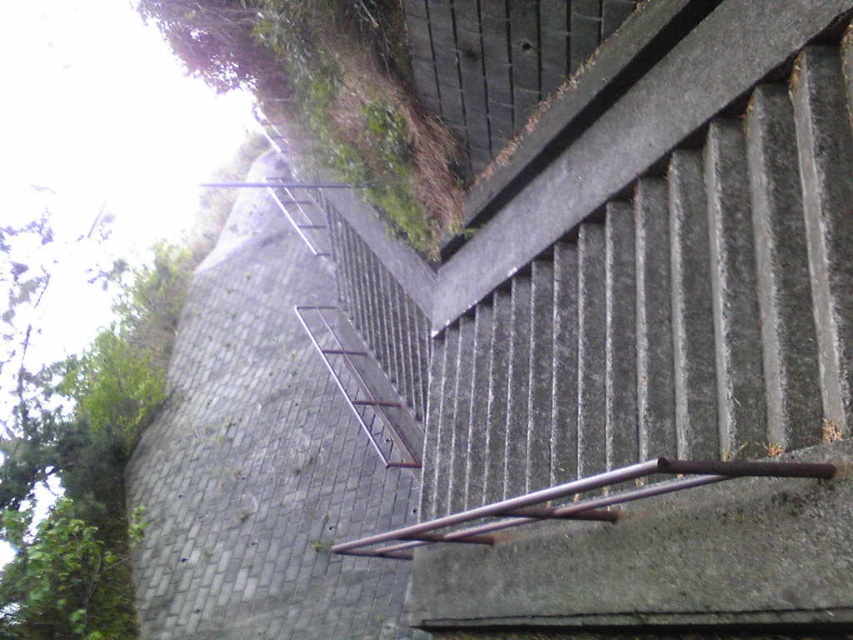
You are standing at the bottom of the stairs and want to reach the top. There are two points marked on the image, point A at coordinates point[170,614] and point B at coordinates point[379,534]. Which point should you aim for first if you want to climb the stairs efficiently?

Point A at coordinates point[170,614] is behind point B at coordinates point[379,534], so you should aim for point B first as it is closer to you at the bottom of the stairs.

You are standing at the bottom of the stairs and want to reach the top. Which object, the gray concrete wall at upper left or the rusty metal rail at center, would you need to climb over or around?

The gray concrete wall at upper left is shorter than the rusty metal rail at center, so you would need to climb over or around the rusty metal rail at center since it is taller.

You are a painter who needs to decide which object to paint first between the gray concrete wall at upper left and the rusty metal rail at center. Based on their sizes, which object requires less time to paint?

The gray concrete wall at upper left requires less time to paint because it has a smaller size compared to the rusty metal rail at center.